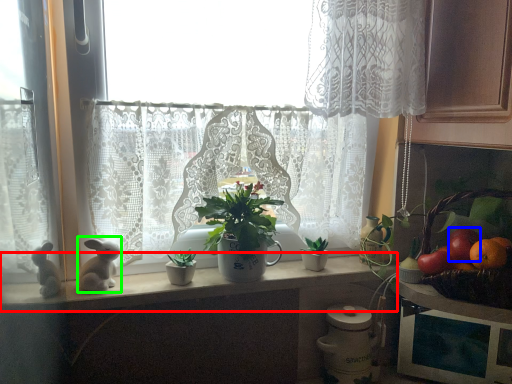
Question: Which object is positioned farthest from counter top (highlighted by a red box)? Select from fruit (highlighted by a blue box) and animal (highlighted by a green box).

Choices:
 (A) fruit
 (B) animal

Answer: (A)